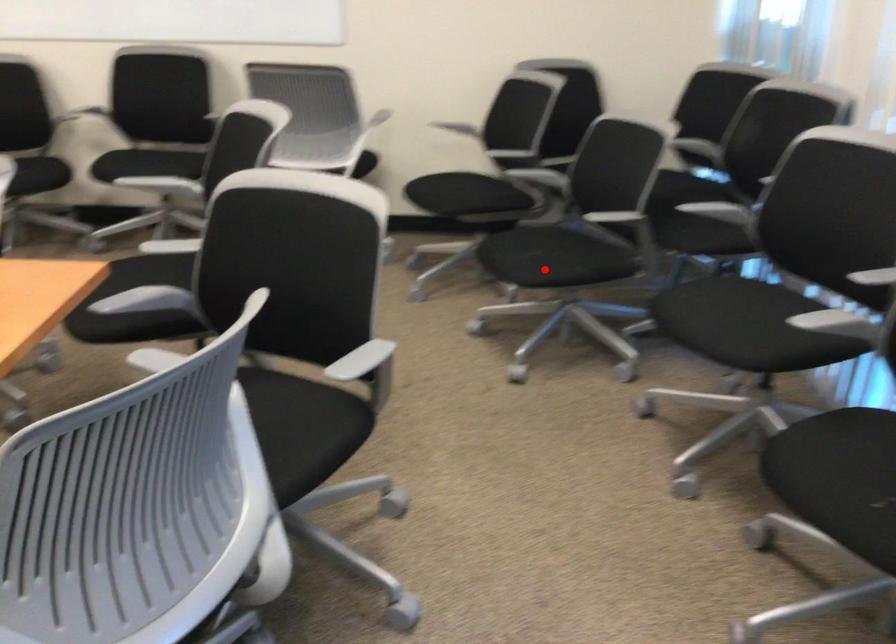
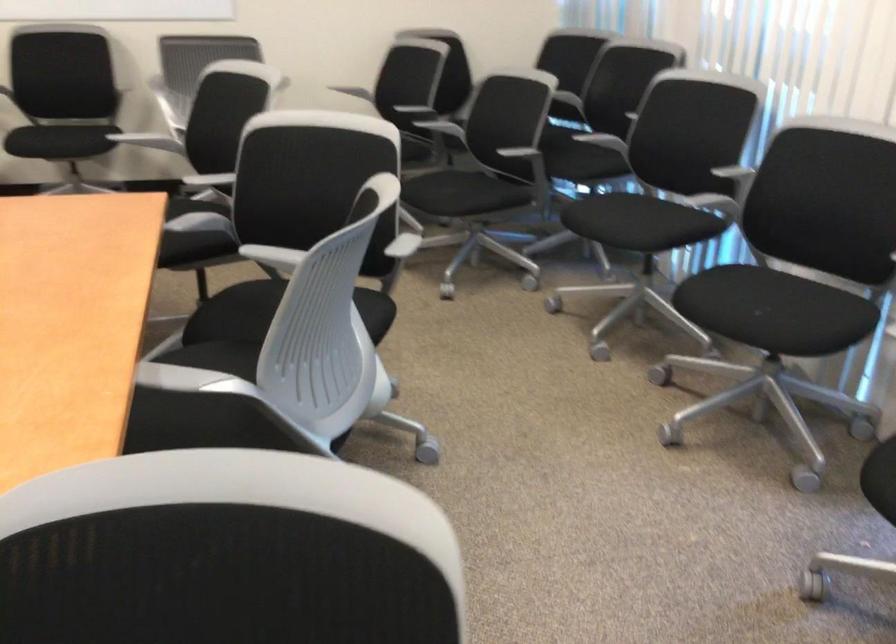
Question: I am providing you with two images of the same scene from different viewpoints. A red point is marked on the first image. Is the red point's position out of view in image 2?

Choices:
 (A) Yes
 (B) No

Answer: (B)